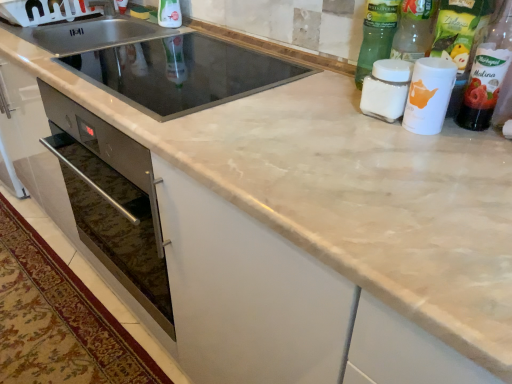
Where is `free space in front of green glass bottle at upper right, positioned as the fourth bottle in right-to-left order`? free space in front of green glass bottle at upper right, positioned as the fourth bottle in right-to-left order is located at coordinates (358, 115).